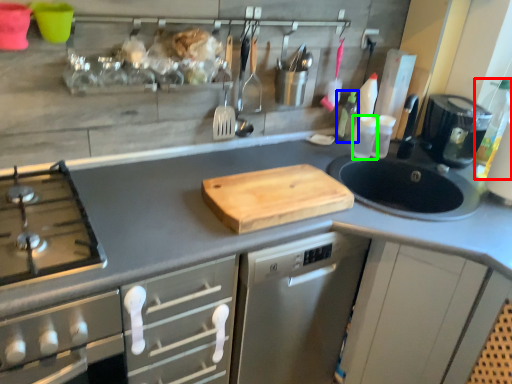
Question: Estimate the real-world distances between objects in this image. Which object is farther from bottle (highlighted by a red box), bottle (highlighted by a blue box) or bottle (highlighted by a green box)?

Choices:
 (A) bottle
 (B) bottle

Answer: (A)